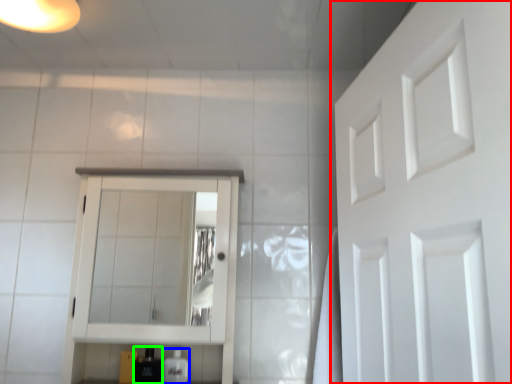
Question: Which is farther away from door (highlighted by a red box)? toiletry (highlighted by a blue box) or toiletry (highlighted by a green box)?

Choices:
 (A) toiletry
 (B) toiletry

Answer: (B)